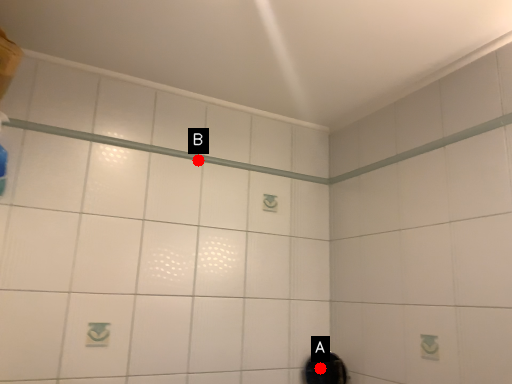
Question: Two points are circled on the image, labeled by A and B beside each circle. Which of the following is the closest to the observer?

Choices:
 (A) A is closer
 (B) B is closer

Answer: (B)